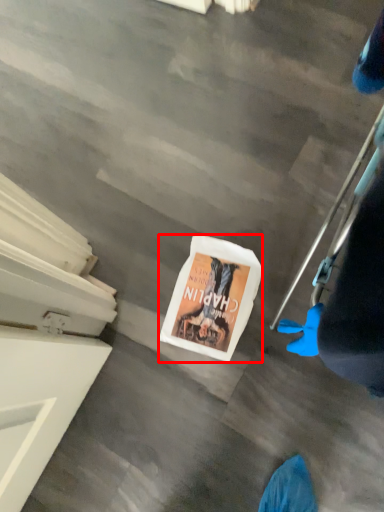
Question: From the image's perspective, considering the relative positions of magazine (annotated by the red box) and person in the image provided, where is magazine (annotated by the red box) located with respect to the staircase?

Choices:
 (A) above
 (B) below

Answer: (B)